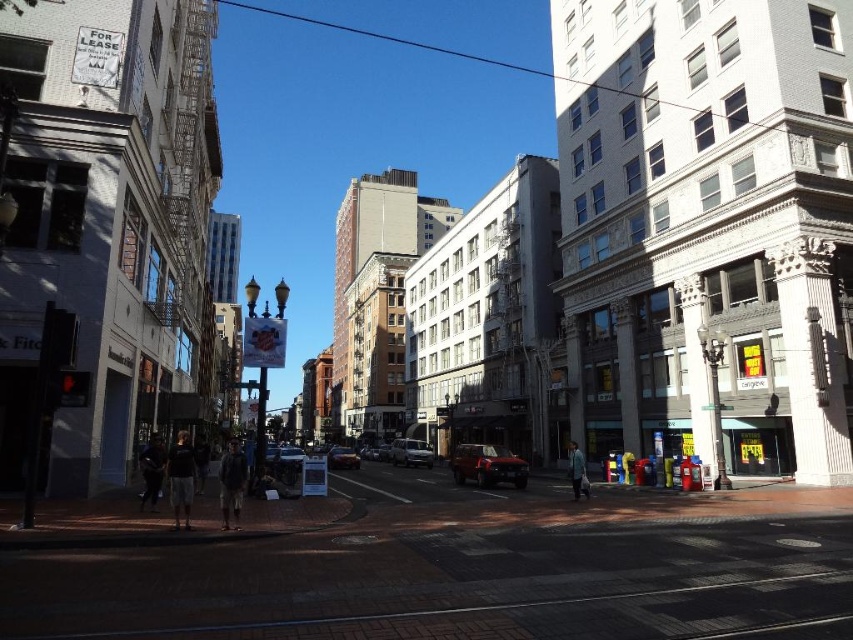
Can you confirm if shiny dark red suv at center is taller than silver metallic sedan at center?

Correct, shiny dark red suv at center is much taller as silver metallic sedan at center.

Is shiny dark red suv at center positioned in front of silver metallic sedan at center?

Yes.

Is point (476, 445) positioned after point (424, 465)?

No.

The height and width of the screenshot is (640, 853). In order to click on shiny dark red suv at center in this screenshot , I will do `click(486, 465)`.

Who is higher up, shiny dark red suv at center or metallic silver car at center?

shiny dark red suv at center is higher up.

This screenshot has height=640, width=853. I want to click on shiny dark red suv at center, so click(486, 465).

Who is more distant from viewer, (485, 472) or (354, 465)?

Positioned behind is point (354, 465).

Find the location of a particular element. The image size is (853, 640). shiny dark red suv at center is located at coordinates point(486,465).

Is silver metallic sedan at center above metallic silver car at center?

Yes, silver metallic sedan at center is above metallic silver car at center.

Is point (416, 448) farther from viewer compared to point (350, 448)?

No, (416, 448) is in front of (350, 448).

What are the coordinates of `silver metallic sedan at center` in the screenshot? It's located at (410, 452).